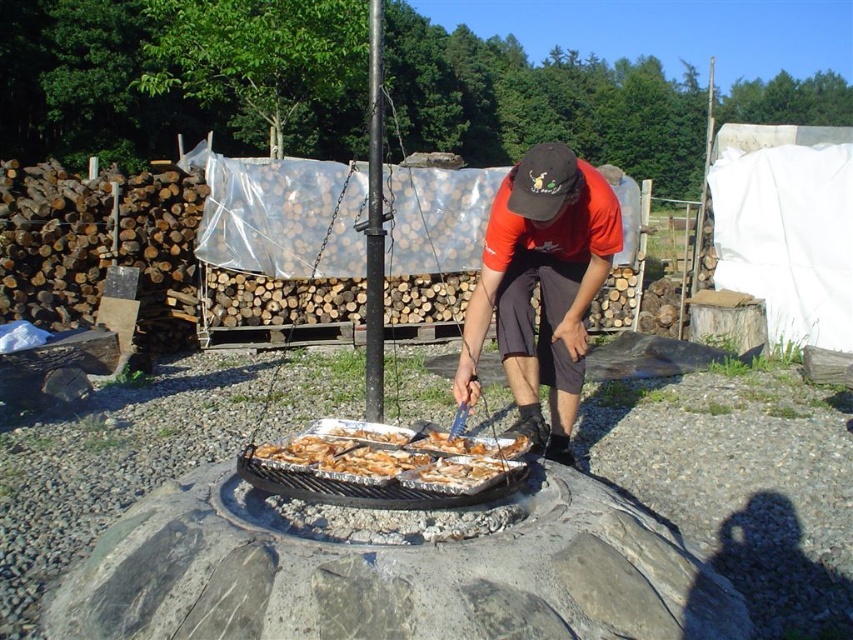
Question: Can you confirm if orange t-shirt at center is positioned to the left of golden brown aluminum tray at center?

Choices:
 (A) yes
 (B) no

Answer: (B)

Question: Is orange t-shirt at center closer to the viewer compared to golden brown aluminum tray at center?

Choices:
 (A) yes
 (B) no

Answer: (B)

Question: Among these points, which one is nearest to the camera?

Choices:
 (A) (564, 204)
 (B) (369, 438)

Answer: (A)

Question: Does orange t-shirt at center lie behind golden brown aluminum tray at center?

Choices:
 (A) yes
 (B) no

Answer: (A)